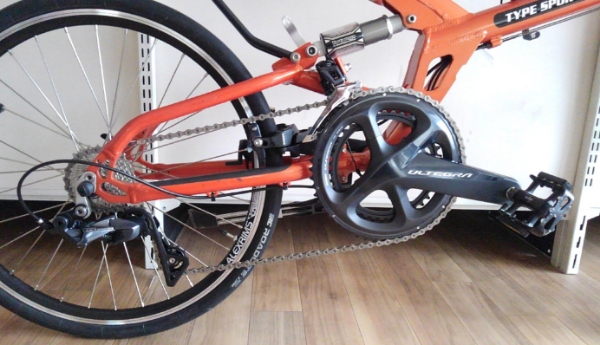
Identify the location of hardwood floor under bike. (382, 290).